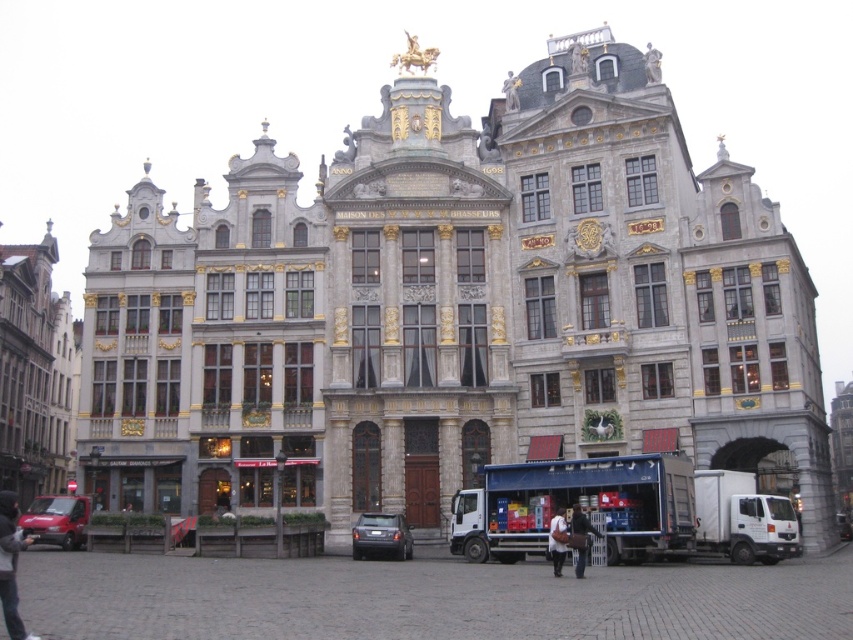
Is dark gray hoodie at lower left positioned behind dark brown leather jacket at lower center?

No, it is in front of dark brown leather jacket at lower center.

Between point (28, 634) and point (582, 515), which one is positioned in front?

Point (28, 634) is in front.

Identify the location of dark gray hoodie at lower left. The width and height of the screenshot is (853, 640). (10, 564).

Is point (387, 545) in front of point (550, 561)?

Yes.

From the picture: Does dark gray metallic car at center have a greater height compared to dark gray shirt at center?

A: In fact, dark gray metallic car at center may be shorter than dark gray shirt at center.

Between point (357, 547) and point (556, 566), which one is positioned behind?

Positioned behind is point (357, 547).

You are a GUI agent. You are given a task and a screenshot of the screen. Output one action in this format:
    pyautogui.click(x=<x>, y=<y>)
    Task: Click on the dark gray metallic car at center
    Image resolution: width=853 pixels, height=640 pixels.
    Given the screenshot: What is the action you would take?
    pyautogui.click(x=381, y=536)

Can you confirm if matte red van at lower left is taller than dark gray shirt at center?

Yes, matte red van at lower left is taller than dark gray shirt at center.

Is matte red van at lower left closer to camera compared to dark gray shirt at center?

Yes, matte red van at lower left is in front of dark gray shirt at center.

What do you see at coordinates (56, 520) in the screenshot?
I see `matte red van at lower left` at bounding box center [56, 520].

Where is `matte red van at lower left`? matte red van at lower left is located at coordinates (56, 520).